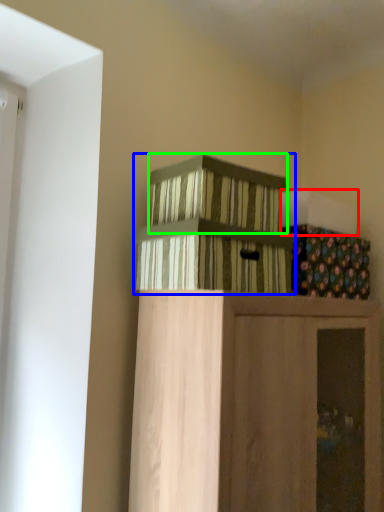
Question: Estimate the real-world distances between objects in this image. Which object is farther from box (highlighted by a red box), crate (highlighted by a blue box) or crate (highlighted by a green box)?

Choices:
 (A) crate
 (B) crate

Answer: (A)